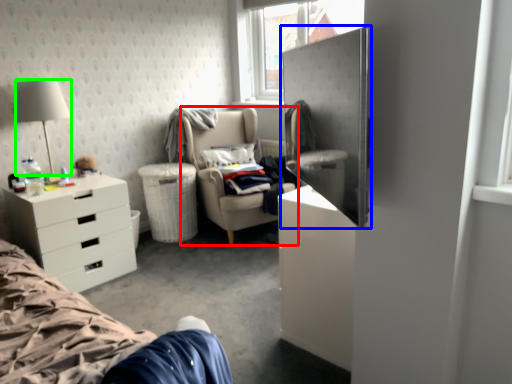
Question: Considering the real-world distances, which object is farthest from chair (highlighted by a red box)? armoire (highlighted by a blue box) or lamp (highlighted by a green box)?

Choices:
 (A) armoire
 (B) lamp

Answer: (A)